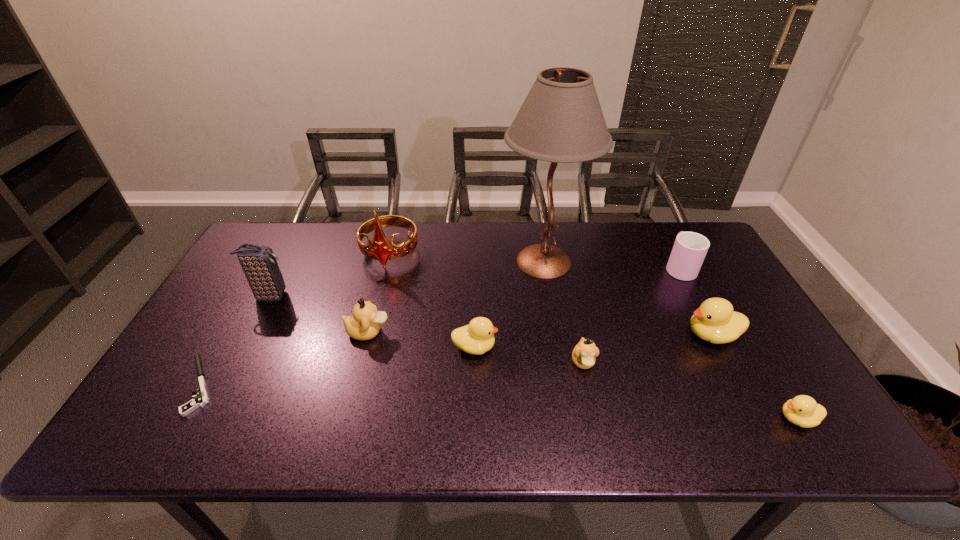
The height and width of the screenshot is (540, 960). What are the coordinates of `the right tan duckling` in the screenshot? It's located at tap(584, 354).

Locate an element on the screen. the nearer tan duckling is located at coordinates (584, 354).

I want to click on the nearest duckling, so click(802, 410).

This screenshot has height=540, width=960. I want to click on the smallest yellow duckling, so click(x=802, y=410).

This screenshot has height=540, width=960. I want to click on black pistol, so click(201, 400).

Where is `the shortest object`? This screenshot has width=960, height=540. the shortest object is located at coordinates (201, 400).

This screenshot has width=960, height=540. Find the location of `blank space located on the front-facing side of the tallest object`. blank space located on the front-facing side of the tallest object is located at coordinates (410, 261).

You are a GUI agent. You are given a task and a screenshot of the screen. Output one action in this format:
    pyautogui.click(x=<x>, y=<y>)
    Task: Click on the free space located 0.400m on the front-facing side of the tallest object
    The height and width of the screenshot is (540, 960).
    Given the screenshot: What is the action you would take?
    pyautogui.click(x=375, y=261)

Find the location of `free space located 0.100m on the front-facing side of the tallest object`. free space located 0.100m on the front-facing side of the tallest object is located at coordinates (468, 261).

The image size is (960, 540). What are the coordinates of `vacant area situated on the front-facing side of the ninth shortest object` in the screenshot? It's located at (378, 299).